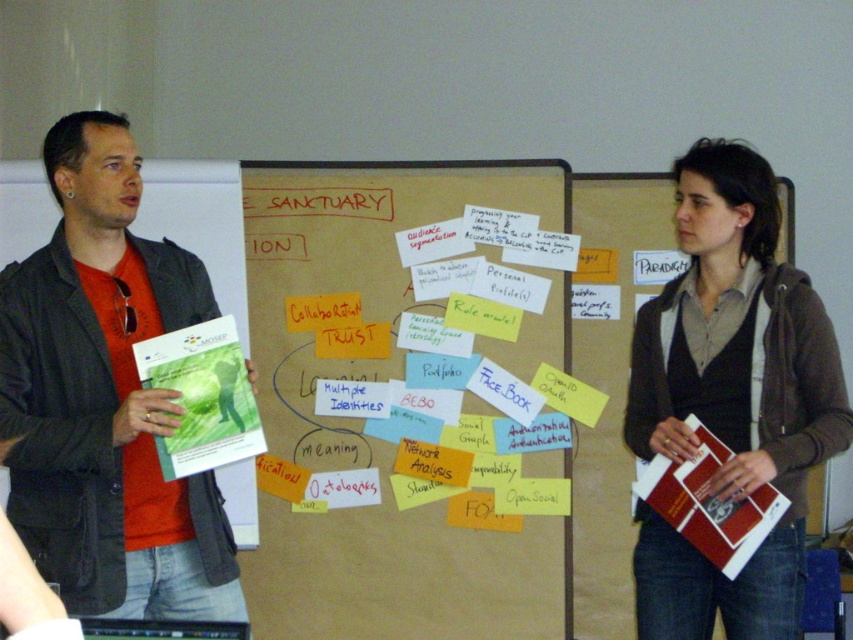
Question: In this image, where is brown paper bulletin board at center located relative to brown textured sweater at center?

Choices:
 (A) below
 (B) above

Answer: (A)

Question: Observing the image, what is the correct spatial positioning of brown paper bulletin board at center in reference to brown textured sweater at center?

Choices:
 (A) right
 (B) left

Answer: (B)

Question: Which point is farther to the camera?

Choices:
 (A) brown textured sweater at center
 (B) brown paper bulletin board at center

Answer: (B)

Question: Is brown paper bulletin board at center smaller than brown textured sweater at center?

Choices:
 (A) yes
 (B) no

Answer: (A)

Question: Among these points, which one is farthest from the camera?

Choices:
 (A) [126, 545]
 (B) [764, 321]

Answer: (B)

Question: Among these points, which one is nearest to the camera?

Choices:
 (A) (62, 218)
 (B) (531, 632)

Answer: (A)